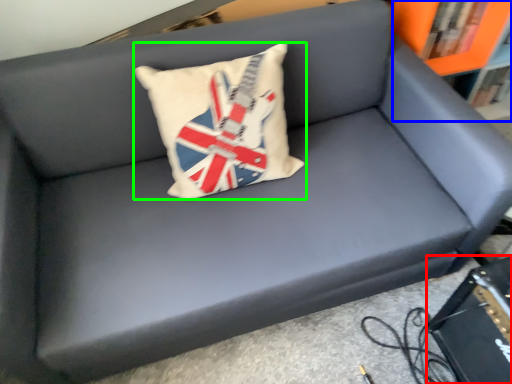
Question: Considering the real-world distances, which object is farthest from paperback book (highlighted by a red box)? bookcase (highlighted by a blue box) or pillow (highlighted by a green box)?

Choices:
 (A) bookcase
 (B) pillow

Answer: (A)